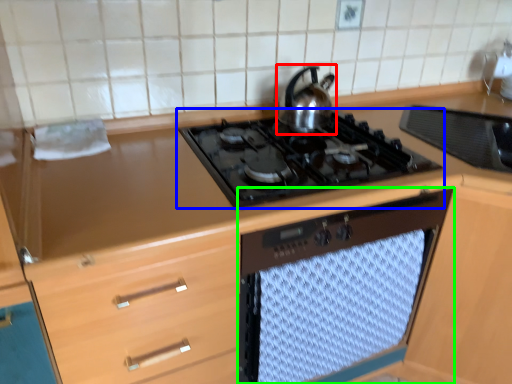
Question: Which object is the farthest from kitchen appliance (highlighted by a red box)? Choose among these: gas stove (highlighted by a blue box) or oven (highlighted by a green box).

Choices:
 (A) gas stove
 (B) oven

Answer: (B)